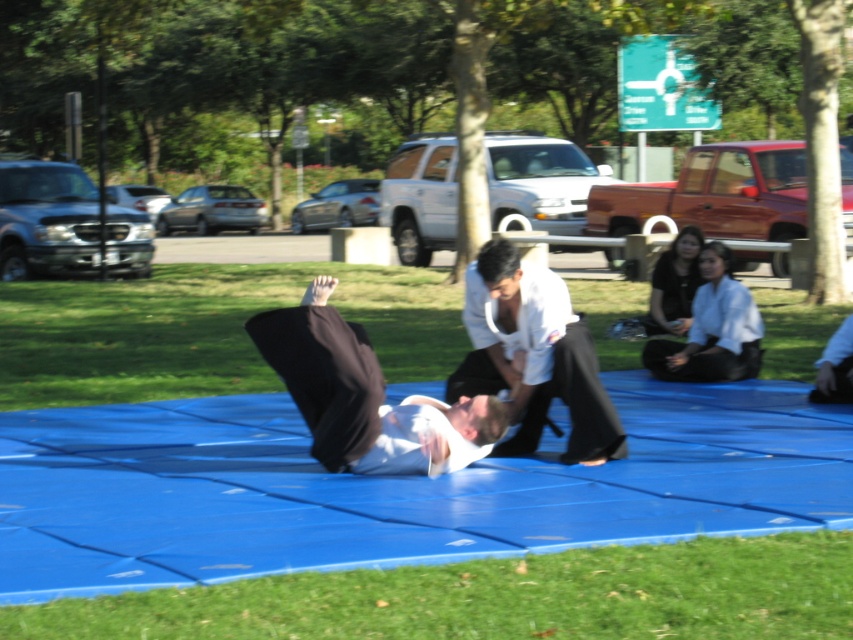
Question: Which object is the closest to the white matte kimono at center?

Choices:
 (A) green grass at lower center
 (B) white fabric kimono at center

Answer: (B)

Question: Does white matte kimono at center have a greater width compared to white fabric kimono at center?

Choices:
 (A) yes
 (B) no

Answer: (B)

Question: Considering the real-world distances, which object is closest to the white fabric kimono at center?

Choices:
 (A) green grass at lower center
 (B) white matte kimono at center

Answer: (B)

Question: Observing the image, what is the correct spatial positioning of green grass at lower center in reference to white matte kimono at center?

Choices:
 (A) right
 (B) left

Answer: (B)

Question: Is white matte kimono at center positioned at the back of white fabric kimono at center?

Choices:
 (A) no
 (B) yes

Answer: (B)

Question: Estimate the real-world distances between objects in this image. Which object is closer to the green grass at lower center?

Choices:
 (A) white matte kimono at center
 (B) white fabric kimono at center

Answer: (B)